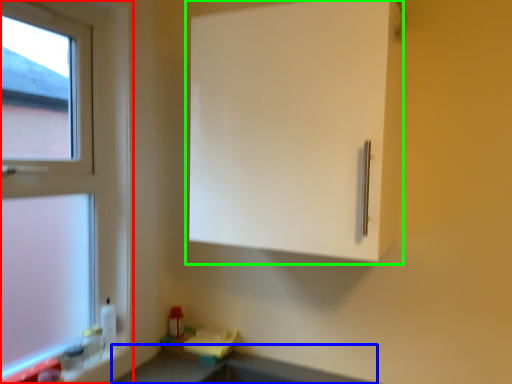
Question: Which is nearer to the window (highlighted by a red box)? counter top (highlighted by a blue box) or cabinetry (highlighted by a green box).

Choices:
 (A) counter top
 (B) cabinetry

Answer: (B)